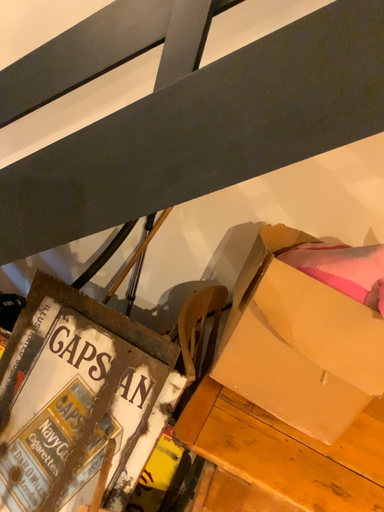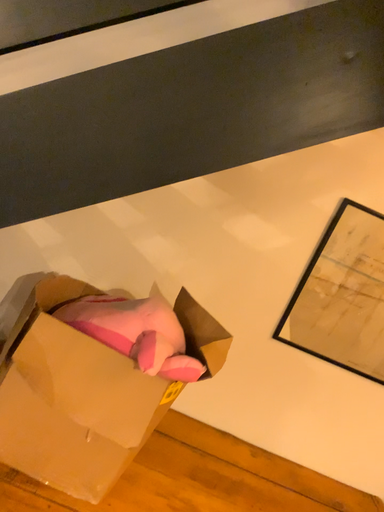
Question: Which way did the camera rotate in the video?

Choices:
 (A) rotated left
 (B) rotated right

Answer: (B)